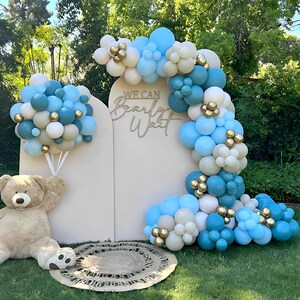
Where is `teddy bear's nose`? The image size is (300, 300). teddy bear's nose is located at coordinates (20, 198).